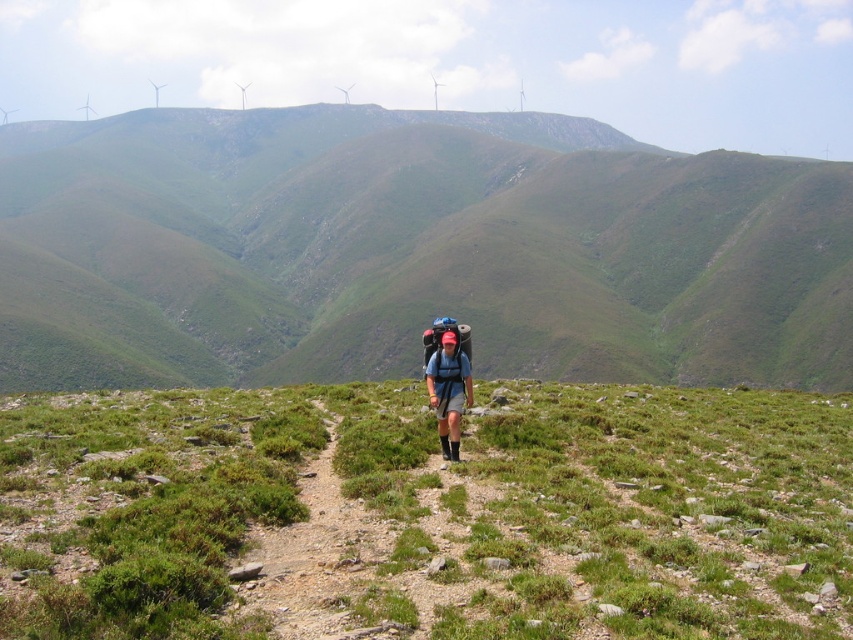
You are a hiker navigating a mountain path. You need to place a marker exactly at the point with coordinates (426, 513). According to the image, what terrain feature will the marker land on?

The point at coordinates (426, 513) corresponds to green grassy at center, so the marker will land on the green grassy area at the center of the image.

You are a hiker planning to set up a tent in the image. The tent requires a flat area of at least 2 meters by 2 meters. Given the green grassy at center, can you determine if the area is suitable for setting up the tent?

The green grassy at center is located at point (426, 513). However, the description does not provide information about the flatness or size of the area, so it is unclear if the green grassy at center is suitable for setting up a tent requiring a 2m x 2m flat area.

You are a drone operator trying to capture the hiker and their backpack in a photo. You have two points marked in the image for focus adjustments. The first point is at coordinates point (631, 336) and the second point is at point (444, 454). Which point should you focus on to ensure the hiker and their backpack are in sharp focus?

Point (631, 336) is further to the viewer than point (444, 454). Therefore, focusing on point (631, 336) will ensure the hiker and their backpack are in sharp focus since it is closer to the camera.